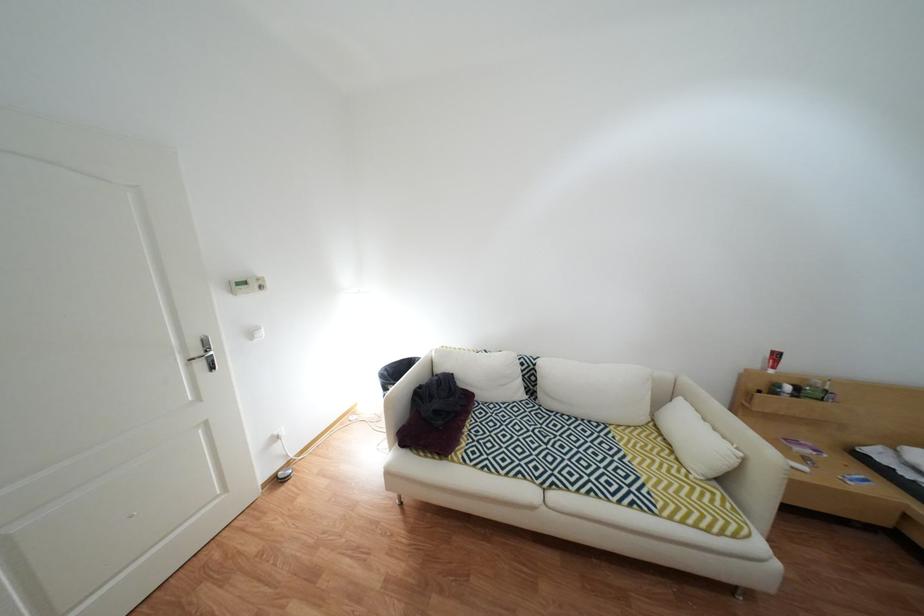
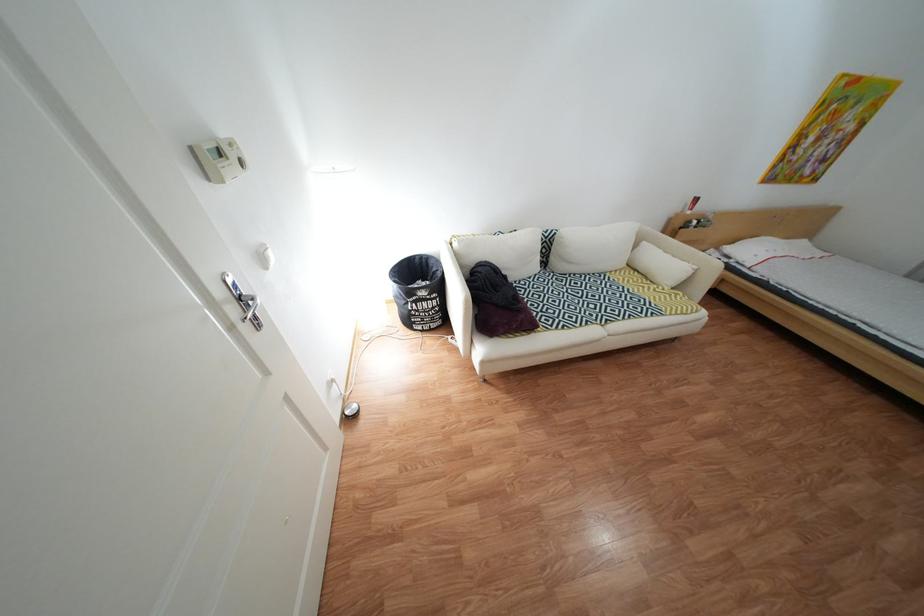
The point at (550, 363) is marked in the first image. Where is the corresponding point in the second image?

(562, 236)